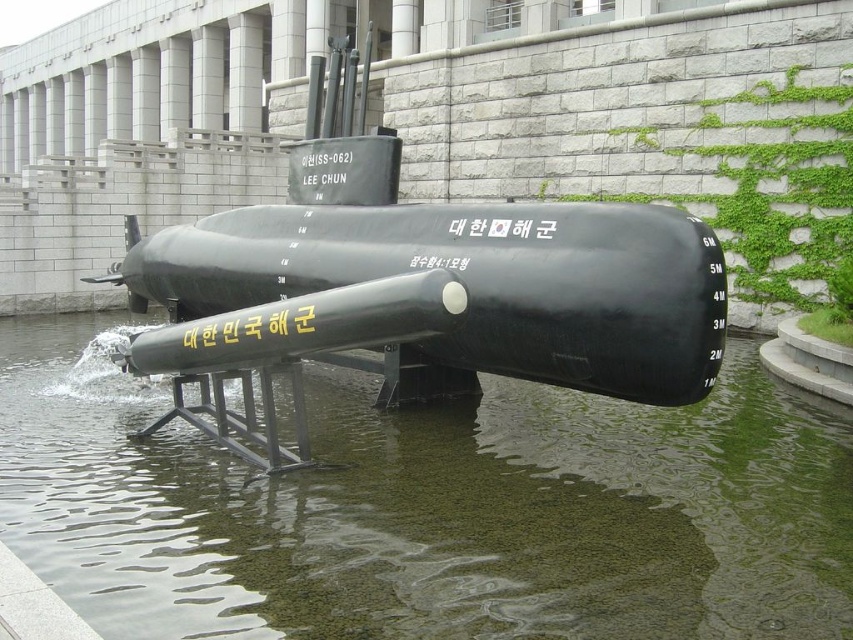
Based on the scene description, where is the transparent water at center located in the image?

The transparent water at center is located at point (426, 508) in the image.

You are a visitor standing in front of the submarine exhibit. You notice the transparent water at center and the black matte submarine at center. Which object is closer to you?

The transparent water at center is closer to the viewer than the black matte submarine at center.

You are standing at point (426, 508) in the image. What is the material of the surface you are currently standing on?

The surface at point (426, 508) is transparent water at center, so you are standing on transparent water at center.